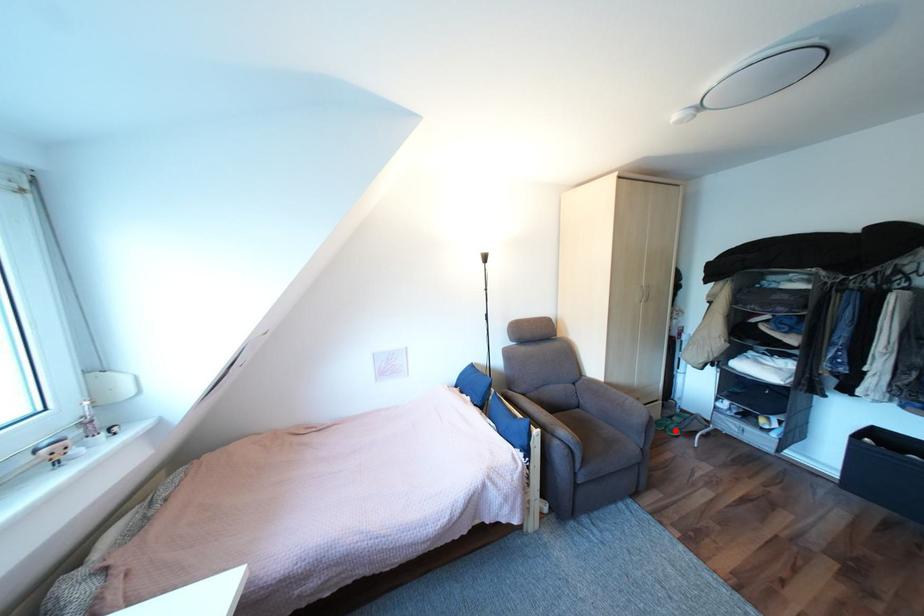
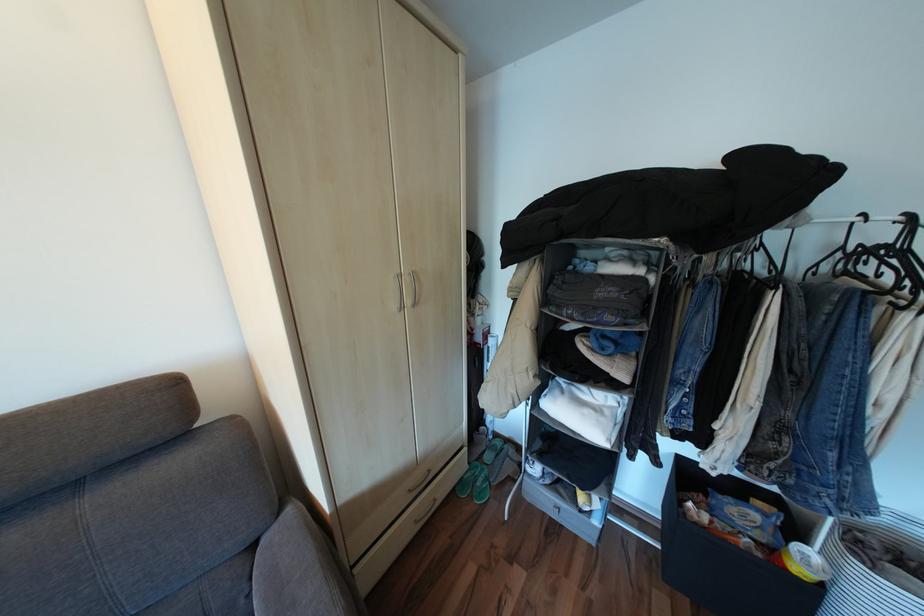
Question: I am providing you with two images of the same scene from different viewpoints. Given a red point in image1, look at the same physical point in image2. Is it:

Choices:
 (A) Closer to the viewpoint
 (B) Farther from the viewpoint

Answer: (A)